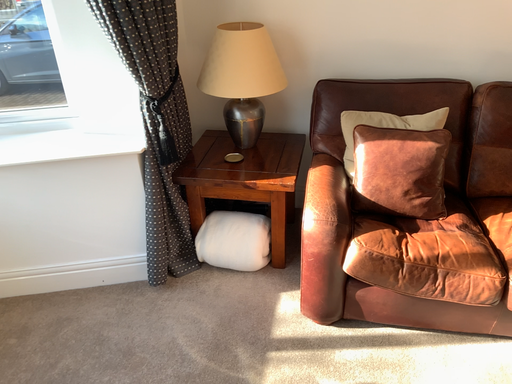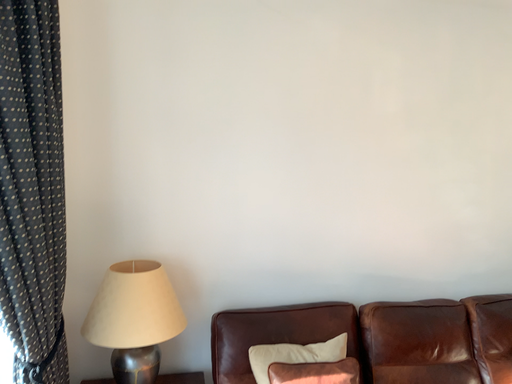
Question: How did the camera likely rotate when shooting the video?

Choices:
 (A) rotated right
 (B) rotated left

Answer: (A)